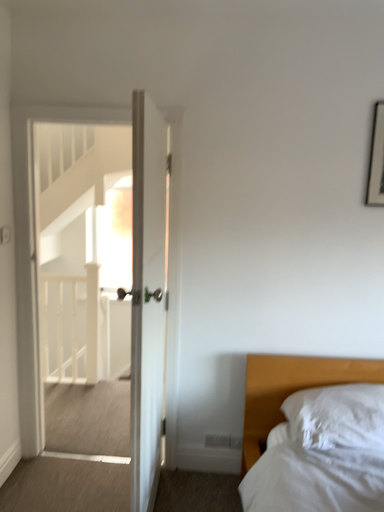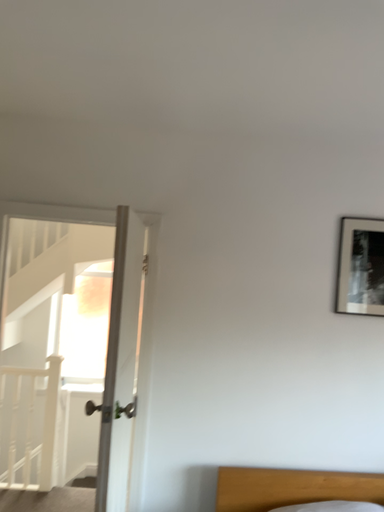
Question: Which way did the camera rotate in the video?

Choices:
 (A) rotated downward
 (B) rotated upward

Answer: (B)